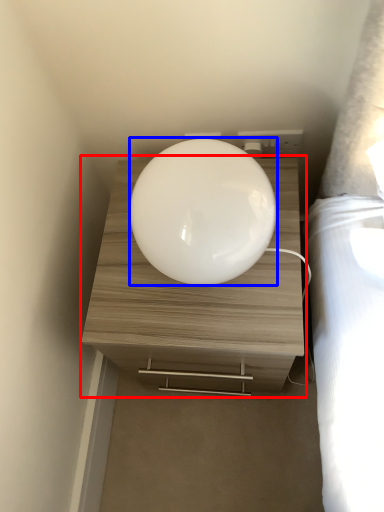
Question: Which object is closer to the camera taking this photo, nightstand (highlighted by a red box) or oval (highlighted by a blue box)?

Choices:
 (A) nightstand
 (B) oval

Answer: (B)